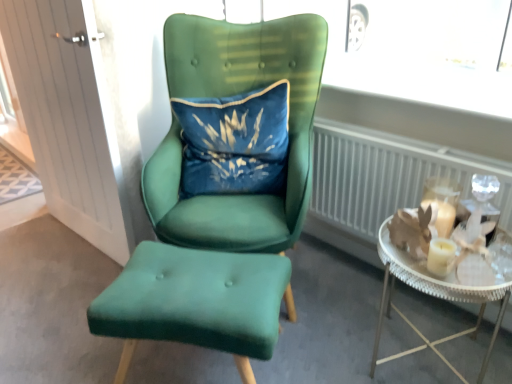
The height and width of the screenshot is (384, 512). Describe the element at coordinates (69, 118) in the screenshot. I see `white wood door at left` at that location.

This screenshot has width=512, height=384. What are the coordinates of `metallic silver tray at right` in the screenshot? It's located at (442, 289).

At what (x,y) coordinates should I click in order to perform the action: click on white wood door at left. Please return your answer as a coordinate pair (x, y). The height and width of the screenshot is (384, 512). Looking at the image, I should click on (69, 118).

From the image's perspective, relative to velvet green chair at center, which appears as the second chair when ordered from the bottom, is white metallic radiator at right above or below?

white metallic radiator at right is below velvet green chair at center, which appears as the second chair when ordered from the bottom.

Considering their positions, is white metallic radiator at right located in front of or behind velvet green chair at center, positioned as the first chair in top-to-bottom order?

white metallic radiator at right is behind velvet green chair at center, positioned as the first chair in top-to-bottom order.

Consider the image. Considering the positions of objects white metallic radiator at right and velvet green chair at center, positioned as the first chair in top-to-bottom order, in the image provided, who is more to the left, white metallic radiator at right or velvet green chair at center, positioned as the first chair in top-to-bottom order,?

velvet green chair at center, positioned as the first chair in top-to-bottom order.

Based on the photo, considering the sizes of objects white metallic radiator at right and velvet green chair at center, which appears as the second chair when ordered from the bottom, in the image provided, who is bigger, white metallic radiator at right or velvet green chair at center, which appears as the second chair when ordered from the bottom,?

velvet green chair at center, which appears as the second chair when ordered from the bottom, is bigger.

Which object is thinner, velvet blue pillow at center or white metallic radiator at right?

white metallic radiator at right is thinner.

Is the depth of velvet blue pillow at center less than that of white metallic radiator at right?

No, velvet blue pillow at center is further to the viewer.

Is velvet blue pillow at center bigger or smaller than white metallic radiator at right?

velvet blue pillow at center is smaller than white metallic radiator at right.

Is velvet blue pillow at center positioned with its back to white metallic radiator at right?

velvet blue pillow at center is not turned away from white metallic radiator at right.

Is white metallic radiator at right positioned behind velvet blue pillow at center?

No, it is in front of velvet blue pillow at center.

From a real-world perspective, who is located higher, white metallic radiator at right or velvet blue pillow at center?

In real-world perspective, velvet blue pillow at center is above.

Identify the location of pillow that is behind the white metallic radiator at right. (234, 142).

Looking at this image, does white wood door at left contain clear glass tray at right?

No, clear glass tray at right is not inside white wood door at left.

Locate an element on the screen. This screenshot has width=512, height=384. glass door behind the clear glass tray at right is located at coordinates (69, 118).

Is white wood door at left in contact with clear glass tray at right?

No.

Is the depth of white wood door at left greater than that of clear glass tray at right?

Yes, white wood door at left is further from the viewer.

Considering the relative sizes of white wood door at left and velvet blue pillow at center in the image provided, is white wood door at left taller than velvet blue pillow at center?

Yes.

Which is farther from the camera, (35, 64) or (177, 107)?

Positioned behind is point (35, 64).

What's the angular difference between white wood door at left and velvet blue pillow at center's facing directions?

45.1 degrees separate the facing orientations of white wood door at left and velvet blue pillow at center.

Does white wood door at left lie behind velvet green chair at center, which appears as the second chair when ordered from the bottom?

Yes, the depth of white wood door at left is greater than that of velvet green chair at center, which appears as the second chair when ordered from the bottom.

There is a velvet green chair at center, which appears as the second chair when ordered from the bottom. Find the location of `glass door above it (from a real-world perspective)`. glass door above it (from a real-world perspective) is located at coordinates (69, 118).

Does point (102, 89) come farther from viewer compared to point (320, 81)?

No, (102, 89) is in front of (320, 81).

Who is shorter, metallic silver tray at right or velvet blue pillow at center?

Standing shorter between the two is velvet blue pillow at center.

Which is behind, point (402, 354) or point (281, 191)?

The point (281, 191) is behind.

In the scene shown: Is metallic silver tray at right facing away from velvet blue pillow at center?

No.

From a real-world perspective, relative to velvet blue pillow at center, is metallic silver tray at right vertically above or below?

metallic silver tray at right is situated lower than velvet blue pillow at center in the real world.

Which chair is the 2nd one when counting from the front of the white metallic radiator at right? Please provide its 2D coordinates.

[(231, 95)]

You are a GUI agent. You are given a task and a screenshot of the screen. Output one action in this format:
    pyautogui.click(x=<x>, y=<y>)
    Task: Click on the pillow that is on the left side of white metallic radiator at right
    This screenshot has height=384, width=512.
    Given the screenshot: What is the action you would take?
    pyautogui.click(x=234, y=142)

In the scene shown: When comparing their distances from velvet green chair at center, positioned as the first chair in top-to-bottom order, does velvet blue pillow at center or velvet green ottoman at center, positioned as the second chair in top-to-bottom order, seem further?

velvet green ottoman at center, positioned as the second chair in top-to-bottom order.

Looking at the image, which one is located further to velvet blue pillow at center, velvet green ottoman at center, positioned as the second chair in top-to-bottom order, or clear glass tray at right?

clear glass tray at right lies further to velvet blue pillow at center than the other object.

Looking at the image, which one is located closer to white metallic radiator at right, velvet blue pillow at center or clear glass tray at right?

Among the two, clear glass tray at right is located nearer to white metallic radiator at right.

From the picture: Estimate the real-world distances between objects in this image. Which object is closer to clear glass tray at right, velvet blue pillow at center or white metallic radiator at right?

white metallic radiator at right is positioned closer to the anchor clear glass tray at right.

Based on their spatial positions, is velvet blue pillow at center or clear glass tray at right further from metallic silver tray at right?

The object further to metallic silver tray at right is velvet blue pillow at center.

Estimate the real-world distances between objects in this image. Which object is closer to white wood door at left, velvet green chair at center, which appears as the second chair when ordered from the bottom, or metallic silver tray at right?

The object closer to white wood door at left is velvet green chair at center, which appears as the second chair when ordered from the bottom.

When comparing their distances from metallic silver tray at right, does clear glass tray at right or velvet green chair at center, which appears as the second chair when ordered from the bottom, seem closer?

Based on the image, clear glass tray at right appears to be nearer to metallic silver tray at right.

Considering their positions, is white wood door at left positioned further to velvet green chair at center, which appears as the second chair when ordered from the bottom, than metallic silver tray at right?

Based on the image, metallic silver tray at right appears to be further to velvet green chair at center, which appears as the second chair when ordered from the bottom.

Where is `glass table situated between white wood door at left and white metallic radiator at right from left to right`? This screenshot has height=384, width=512. glass table situated between white wood door at left and white metallic radiator at right from left to right is located at coordinates (450, 272).

You are a GUI agent. You are given a task and a screenshot of the screen. Output one action in this format:
    pyautogui.click(x=<x>, y=<y>)
    Task: Click on the chair between velvet green ottoman at center, positioned as the second chair in top-to-bottom order, and white metallic radiator at right, in the horizontal direction
    
    Given the screenshot: What is the action you would take?
    pyautogui.click(x=231, y=95)

The image size is (512, 384). In order to click on table located between velvet green ottoman at center, positioned as the second chair in top-to-bottom order, and clear glass tray at right in the left-right direction in this screenshot , I will do `click(442, 289)`.

You are a GUI agent. You are given a task and a screenshot of the screen. Output one action in this format:
    pyautogui.click(x=<x>, y=<y>)
    Task: Click on the chair between white wood door at left and velvet green chair at center, positioned as the first chair in top-to-bottom order
    The image size is (512, 384).
    Given the screenshot: What is the action you would take?
    pyautogui.click(x=196, y=302)